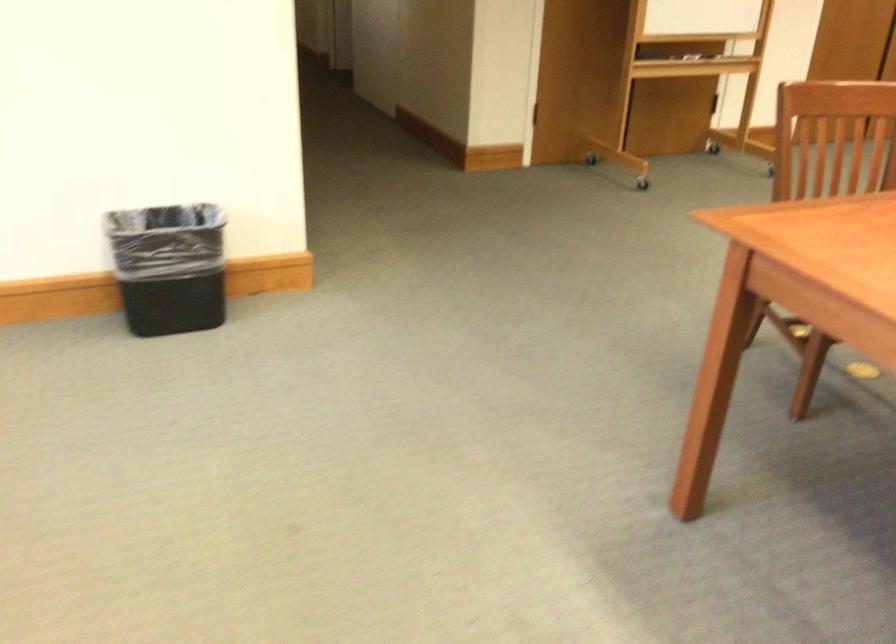
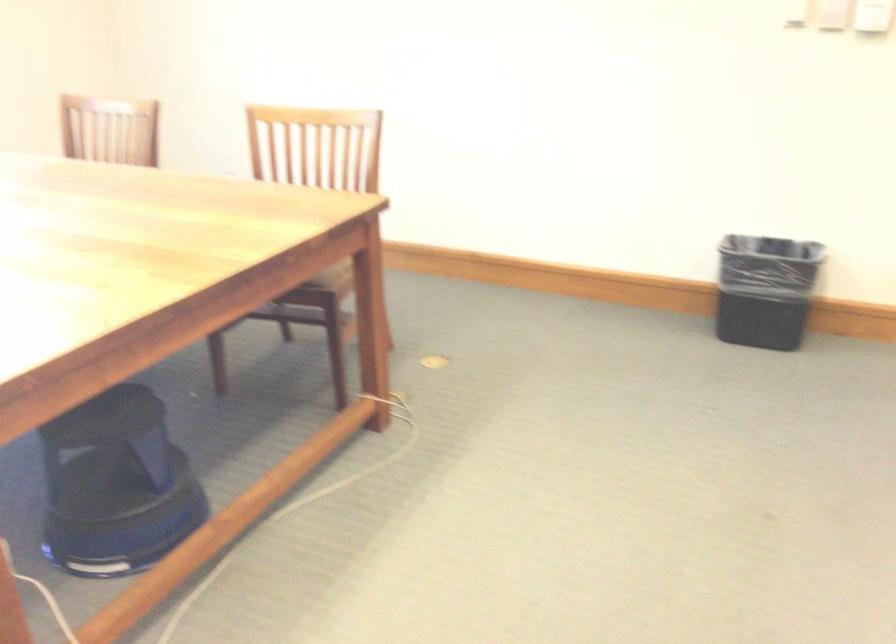
Question: How did the camera likely rotate?

Choices:
 (A) Left
 (B) Right
 (C) Up
 (D) Down

Answer: (A)